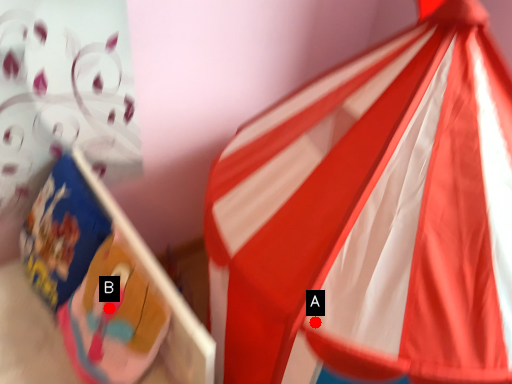
Question: Two points are circled on the image, labeled by A and B beside each circle. Which of the following is the closest to the observer?

Choices:
 (A) A is closer
 (B) B is closer

Answer: (A)